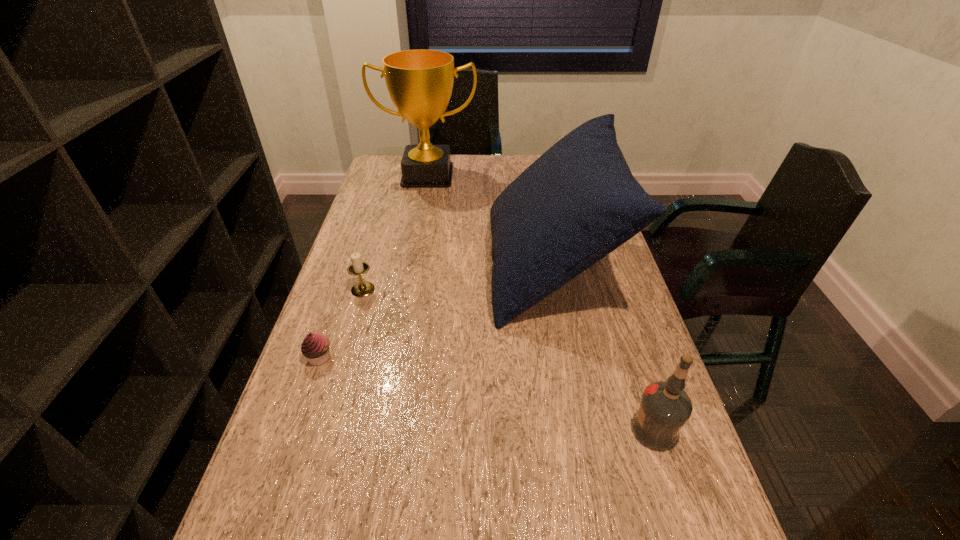
Identify the location of cushion present at the right edge. This screenshot has width=960, height=540. (578, 202).

Find the location of a particular element. The height and width of the screenshot is (540, 960). vodka that is at the right edge is located at coordinates (665, 407).

Locate an element on the screen. The width and height of the screenshot is (960, 540). object located at the far left corner is located at coordinates (420, 82).

Locate an element on the screen. This screenshot has width=960, height=540. vacant area at the far edge is located at coordinates (464, 173).

What are the coordinates of `blank space at the left edge` in the screenshot? It's located at (381, 245).

This screenshot has height=540, width=960. I want to click on blank area at the right edge, so click(x=613, y=270).

Where is `vacant space at the far left corner of the desktop`? vacant space at the far left corner of the desktop is located at coordinates (378, 177).

Locate an element on the screen. This screenshot has height=540, width=960. free spot between the nearest object and the shortest object is located at coordinates (487, 394).

Where is `free space between the cushion and the candle holder`? The width and height of the screenshot is (960, 540). free space between the cushion and the candle holder is located at coordinates (456, 278).

At what (x,y) coordinates should I click in order to perform the action: click on free space between the cushion and the vodka. Please return your answer as a coordinate pair (x, y). Looking at the image, I should click on (602, 349).